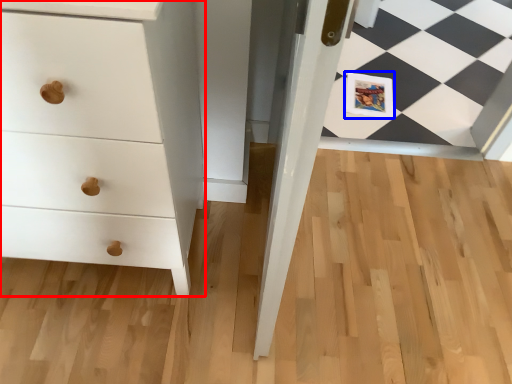
Question: Which point is further to the camera, chest of drawers (highlighted by a red box) or postcard (highlighted by a blue box)?

Choices:
 (A) chest of drawers
 (B) postcard

Answer: (B)